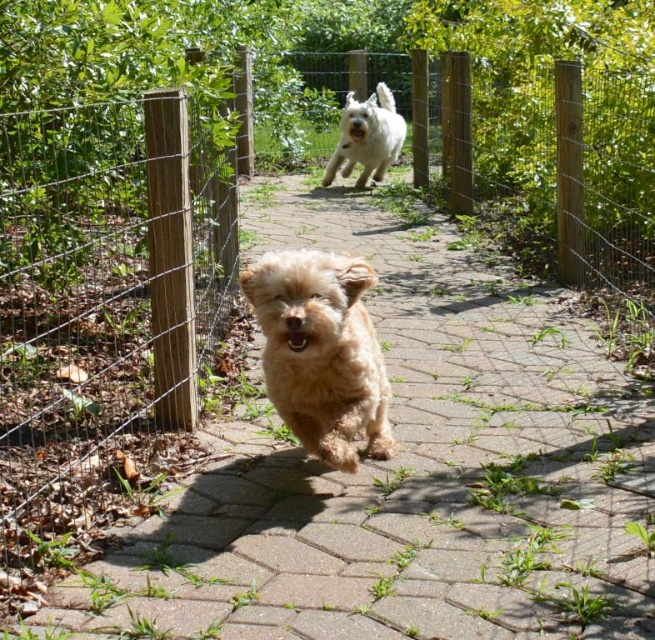
Who is positioned more to the left, fuzzy golden dog at center or white fluffy dog at center?

Positioned to the left is fuzzy golden dog at center.

Which is below, fuzzy golden dog at center or white fluffy dog at center?

Positioned lower is fuzzy golden dog at center.

Which is in front, point (320, 374) or point (360, 116)?

Point (320, 374) is in front.

Find the location of `fuzzy golden dog at center`. fuzzy golden dog at center is located at coordinates (322, 352).

Which is more to the left, wooden post at left or fuzzy golden dog at center?

wooden post at left is more to the left.

The width and height of the screenshot is (655, 640). I want to click on wooden post at left, so click(x=103, y=305).

Is brown brick path at center shorter than wooden post at left?

Correct, brown brick path at center is not as tall as wooden post at left.

Between brown brick path at center and wooden post at left, which one appears on the left side from the viewer's perspective?

Positioned to the left is wooden post at left.

Does point (458, 493) lie behind point (183, 97)?

No, (458, 493) is in front of (183, 97).

Locate an element on the screen. This screenshot has width=655, height=640. brown brick path at center is located at coordinates (405, 474).